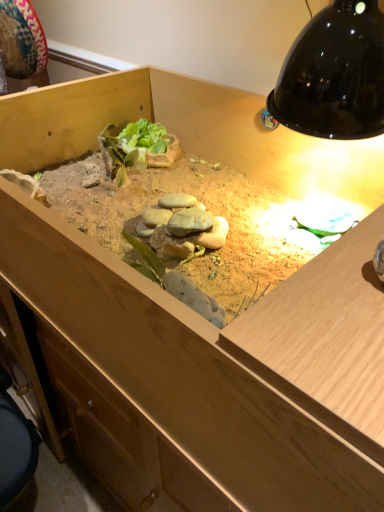
I want to click on black glossy lamp at upper right, so click(334, 74).

The height and width of the screenshot is (512, 384). What do you see at coordinates (334, 74) in the screenshot? I see `black glossy lamp at upper right` at bounding box center [334, 74].

The height and width of the screenshot is (512, 384). Identify the location of black glossy lamp at upper right. (334, 74).